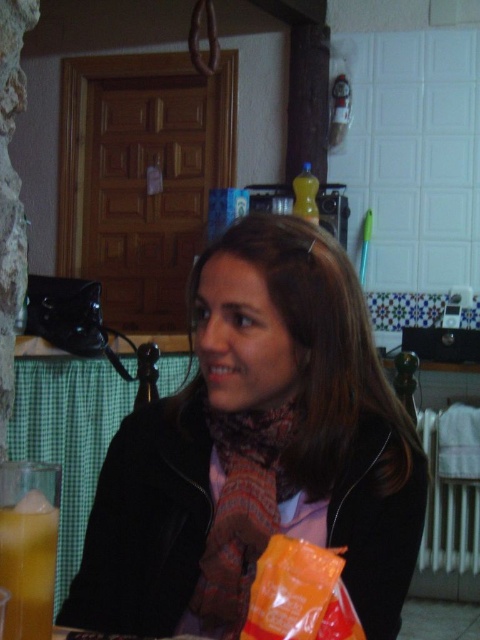
Question: Does matte black jacket at center have a lesser width compared to translucent glass juice at lower left?

Choices:
 (A) no
 (B) yes

Answer: (A)

Question: Does matte black jacket at center have a larger size compared to multicolored woven scarf at center?

Choices:
 (A) yes
 (B) no

Answer: (A)

Question: Does matte black jacket at center come in front of multicolored woven scarf at center?

Choices:
 (A) yes
 (B) no

Answer: (A)

Question: Among these objects, which one is nearest to the camera?

Choices:
 (A) matte black jacket at center
 (B) multicolored woven scarf at center

Answer: (A)

Question: Which is farther from the matte black jacket at center?

Choices:
 (A) translucent glass juice at lower left
 (B) multicolored woven scarf at center

Answer: (A)

Question: Which point is farther to the camera?

Choices:
 (A) translucent glass juice at lower left
 (B) multicolored woven scarf at center

Answer: (B)